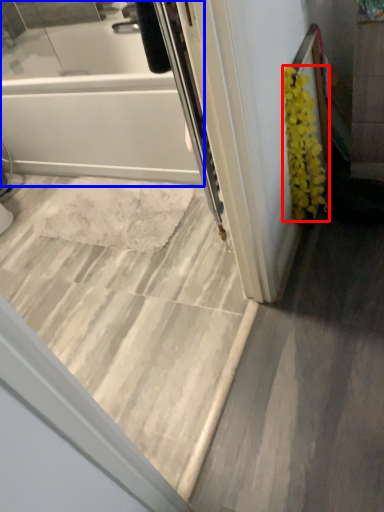
Question: Which point is further to the camera, flower (highlighted by a red box) or bathtub (highlighted by a blue box)?

Choices:
 (A) flower
 (B) bathtub

Answer: (A)